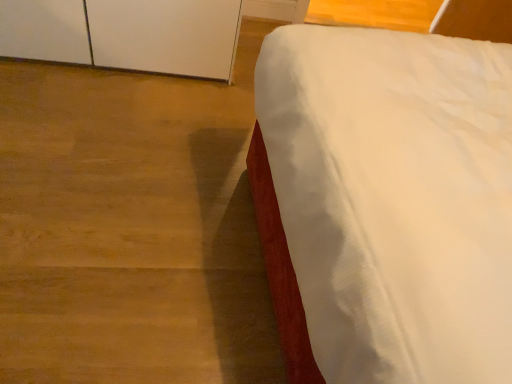
Where is `white fabric bed at right`? The height and width of the screenshot is (384, 512). white fabric bed at right is located at coordinates (384, 203).

The image size is (512, 384). What do you see at coordinates (384, 203) in the screenshot? I see `white fabric bed at right` at bounding box center [384, 203].

This screenshot has width=512, height=384. What are the coordinates of `white fabric bed at right` in the screenshot? It's located at (384, 203).